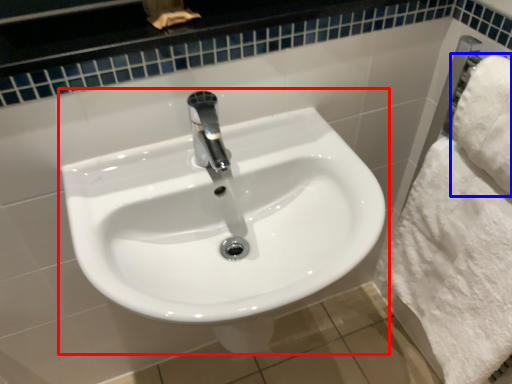
Question: Which object is closer to the camera taking this photo, sink (highlighted by a red box) or bath towel (highlighted by a blue box)?

Choices:
 (A) sink
 (B) bath towel

Answer: (A)